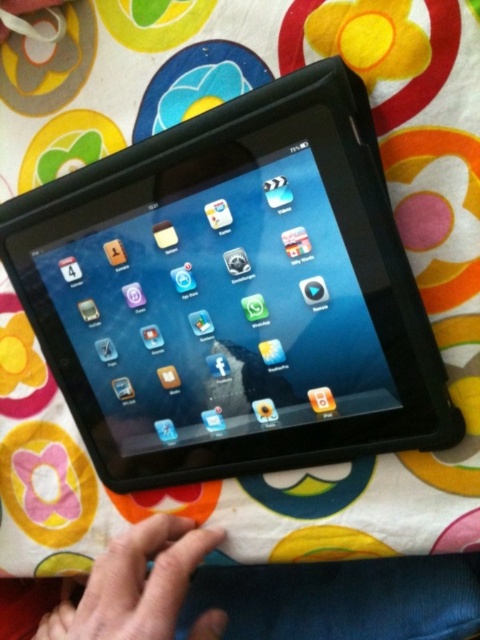
Based on the photo, what object is located at the coordinates point (232, 292) in the image?

The point (232, 292) indicates the location of the black matte tablet at center.